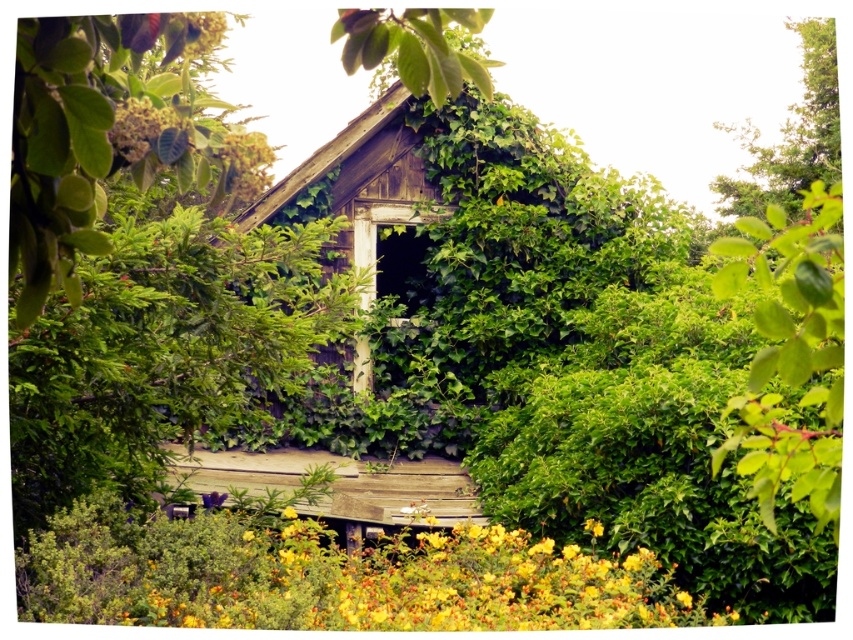
Can you confirm if wooden hut at center is bigger than yellow textured flower at upper left?

No.

What do you see at coordinates (454, 268) in the screenshot? I see `wooden hut at center` at bounding box center [454, 268].

This screenshot has height=640, width=853. I want to click on wooden hut at center, so pyautogui.click(x=454, y=268).

Where is `wooden hut at center`? Image resolution: width=853 pixels, height=640 pixels. wooden hut at center is located at coordinates (454, 268).

Can you confirm if yellow textured flower at upper left is taller than yellow matte flower at lower center?

Yes, yellow textured flower at upper left is taller than yellow matte flower at lower center.

Between yellow textured flower at upper left and yellow matte flower at lower center, which one has less height?

With less height is yellow matte flower at lower center.

Where is `yellow textured flower at upper left`? Image resolution: width=853 pixels, height=640 pixels. yellow textured flower at upper left is located at coordinates (202, 33).

Can you confirm if wooden hut at center is taller than yellow matte flower at lower center?

Yes.

Does wooden hut at center lie behind yellow matte flower at lower center?

Yes, it is.

Does point (320, 422) come farther from viewer compared to point (289, 506)?

Yes, it is behind point (289, 506).

This screenshot has width=853, height=640. What are the coordinates of `wooden hut at center` in the screenshot? It's located at (454, 268).